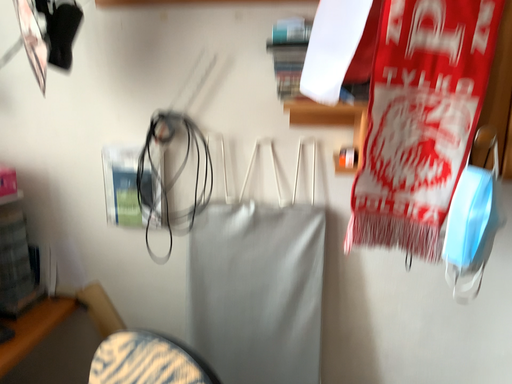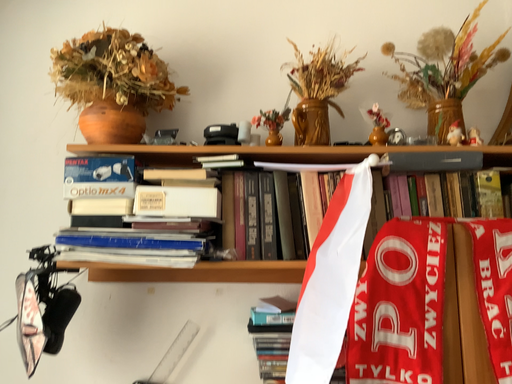
Question: Which way did the camera rotate in the video?

Choices:
 (A) rotated upward
 (B) rotated downward

Answer: (A)